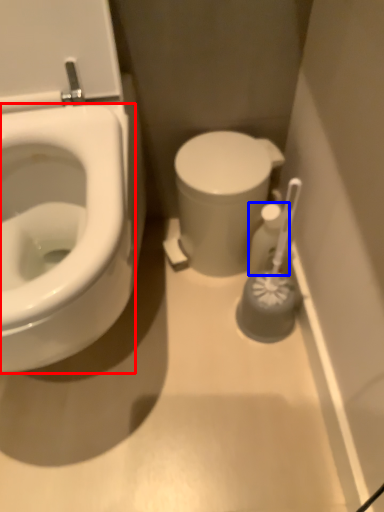
Question: Which point is further to the camera, bidet (highlighted by a red box) or toiletry (highlighted by a blue box)?

Choices:
 (A) bidet
 (B) toiletry

Answer: (B)